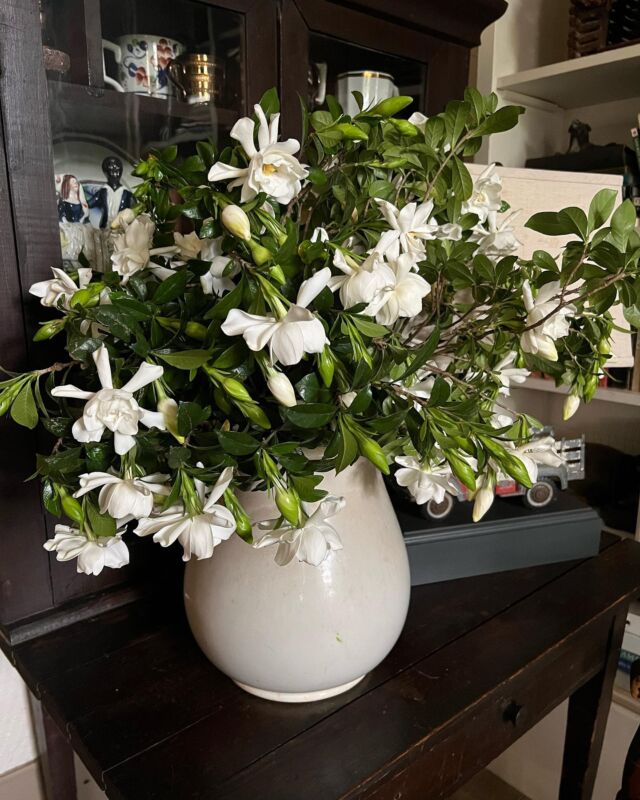
The width and height of the screenshot is (640, 800). What are the coordinates of `top white shelf` in the screenshot? It's located at (564, 66).